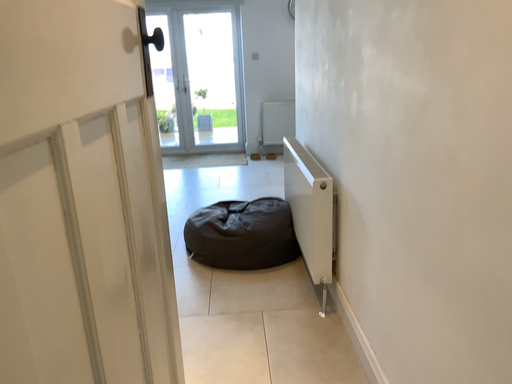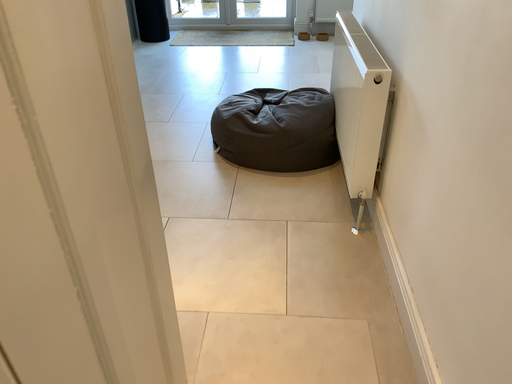
Question: How did the camera likely rotate when shooting the video?

Choices:
 (A) rotated upward
 (B) rotated downward

Answer: (B)